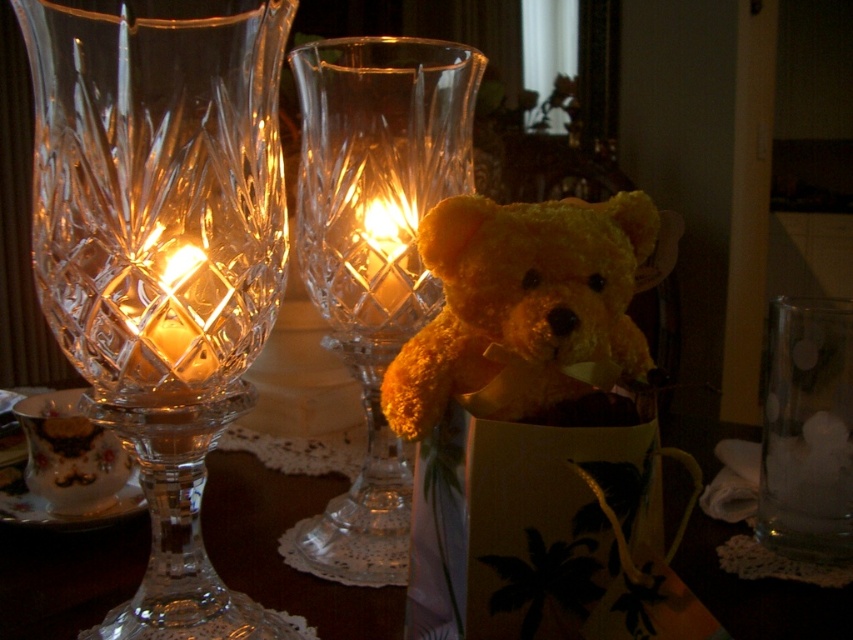
You are a photographer aiming to capture a detailed shot of both the yellow plush bear at center and the translucent glass candle at center. Since you want to focus on the bear first, which object should you adjust your camera focus on first based on their positions?

The yellow plush bear at center is closer to the viewer than the translucent glass candle at center, so you should focus on the yellow plush bear at center first.

You are standing in the room and want to place a new decorative item exactly at the location of the yellow plush bear at center. What are the coordinates where you should place it?

The coordinates for the yellow plush bear at center are at point (521, 304), so you should place the new decorative item at those coordinates.

You are arranging a dinner table and have placed a clear crystal wine glass at center and a translucent glass candle at center. According to the scene description, which object is located to the left of the other?

The clear crystal wine glass at center is positioned on the left side of the translucent glass candle at center.